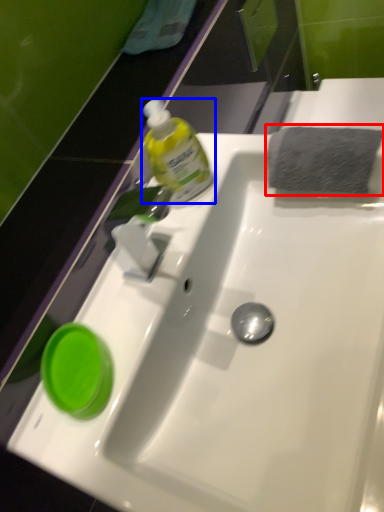
Question: Which of the following is the closest to the observer, hand towel (highlighted by a red box) or bottle (highlighted by a blue box)?

Choices:
 (A) hand towel
 (B) bottle

Answer: (B)